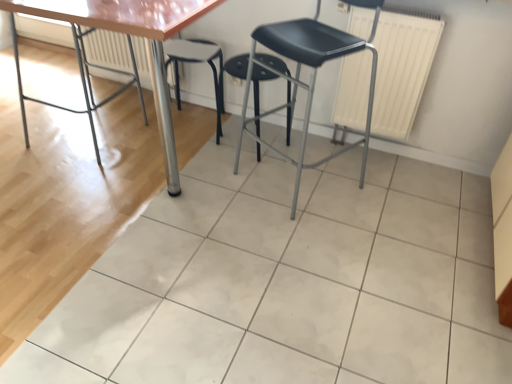
What is the approximate height of white matte radiator at upper right, placed as the 2th radiator when sorted from left to right?

The height of white matte radiator at upper right, placed as the 2th radiator when sorted from left to right, is 24.46 inches.

In order to face black plastic stool at center, acting as the second stool starting from the left, should I rotate leftwards or rightwards?

Turn right by 0.582 degrees to look at black plastic stool at center, acting as the second stool starting from the left.

Image resolution: width=512 pixels, height=384 pixels. What do you see at coordinates (197, 62) in the screenshot?
I see `black plastic stool at center, arranged as the 1th stool when viewed from the left` at bounding box center [197, 62].

Describe the element at coordinates (311, 74) in the screenshot. I see `matte black stool at center` at that location.

Locate an element on the screen. white matte radiator at upper right, which appears as the 1th radiator when viewed from the right is located at coordinates (402, 68).

Would you say white matte radiator at upper right, the second radiator positioned from the back, is outside white textured radiator at upper center, which is counted as the 2th radiator, starting from the front?

Yes.

Looking at the image, does white matte radiator at upper right, which appears as the 1th radiator when viewed from the right, seem bigger or smaller compared to white textured radiator at upper center, which is counted as the first radiator, starting from the left?

In the image, white matte radiator at upper right, which appears as the 1th radiator when viewed from the right, appears to be smaller than white textured radiator at upper center, which is counted as the first radiator, starting from the left.

You are a GUI agent. You are given a task and a screenshot of the screen. Output one action in this format:
    pyautogui.click(x=<x>, y=<y>)
    Task: Click on the radiator above the white matte radiator at upper right, the second radiator positioned from the back (from the image's perspective)
    The width and height of the screenshot is (512, 384).
    Given the screenshot: What is the action you would take?
    pyautogui.click(x=108, y=50)

How much distance is there between white matte radiator at upper right, placed as the 2th radiator when sorted from left to right, and white textured radiator at upper center, which is counted as the 2th radiator, starting from the front?

white matte radiator at upper right, placed as the 2th radiator when sorted from left to right, is 1.26 meters from white textured radiator at upper center, which is counted as the 2th radiator, starting from the front.

From the image's perspective, which radiator is the 2nd one above the white glossy tile at center? Please provide its 2D coordinates.

[(108, 50)]

In terms of height, does white textured radiator at upper center, the second radiator from the right, look taller or shorter compared to white glossy tile at center?

Considering their sizes, white textured radiator at upper center, the second radiator from the right, has more height than white glossy tile at center.

Is white textured radiator at upper center, the second radiator from the right, further to the viewer compared to white glossy tile at center?

Yes, white textured radiator at upper center, the second radiator from the right, is further from the camera.

Is white textured radiator at upper center, the second radiator from the right, next to white glossy tile at center and touching it?

white textured radiator at upper center, the second radiator from the right, is not next to white glossy tile at center, and they're not touching.

Which object is closer to the camera, black plastic stool at center, the 1th stool viewed from the right, or metallic polished table at left?

metallic polished table at left is in front.

The image size is (512, 384). Identify the location of table located above the black plastic stool at center, the 1th stool viewed from the right (from a real-world perspective). (132, 34).

How distant is black plastic stool at center, the 1th stool viewed from the right, from metallic polished table at left?

black plastic stool at center, the 1th stool viewed from the right, is 74.05 centimeters from metallic polished table at left.

Based on the photo, would you say matte black stool at center is to the left or to the right of white matte radiator at upper right, the second radiator positioned from the back, in the picture?

matte black stool at center is positioned on white matte radiator at upper right, the second radiator positioned from the back,'s left side.

Is matte black stool at center positioned with its back to white matte radiator at upper right, which appears as the first radiator when viewed from the front?

Yes, matte black stool at center is positioned with its back facing white matte radiator at upper right, which appears as the first radiator when viewed from the front.

From a real-world perspective, is matte black stool at center beneath white matte radiator at upper right, placed as the 2th radiator when sorted from left to right?

No, from a real-world perspective, matte black stool at center is not under white matte radiator at upper right, placed as the 2th radiator when sorted from left to right.

Can you confirm if matte black stool at center is smaller than white matte radiator at upper right, the second radiator positioned from the back?

No.

Is metallic polished table at left positioned far away from black plastic stool at center, the second stool from the right?

metallic polished table at left is near black plastic stool at center, the second stool from the right, not far away.

Which is more to the right, metallic polished table at left or black plastic stool at center, the second stool from the right?

black plastic stool at center, the second stool from the right, is more to the right.

Is metallic polished table at left facing towards black plastic stool at center, arranged as the 1th stool when viewed from the left?

Yes, metallic polished table at left faces towards black plastic stool at center, arranged as the 1th stool when viewed from the left.

Considering the sizes of objects metallic polished table at left and black plastic stool at center, the second stool from the right, in the image provided, who is shorter, metallic polished table at left or black plastic stool at center, the second stool from the right,?

With less height is black plastic stool at center, the second stool from the right.

From the image's perspective, is white matte radiator at upper right, the second radiator positioned from the back, located above or below matte black stool at center?

white matte radiator at upper right, the second radiator positioned from the back, is above matte black stool at center.

Measure the distance between white matte radiator at upper right, which appears as the first radiator when viewed from the front, and matte black stool at center.

7.20 inches.

Is white matte radiator at upper right, placed as the 2th radiator when sorted from left to right, looking in the opposite direction of matte black stool at center?

white matte radiator at upper right, placed as the 2th radiator when sorted from left to right, does not have its back to matte black stool at center.

Is point (106, 30) closer or farther from the camera than point (288, 137)?

Point (106, 30) is positioned closer to the camera compared to point (288, 137).

The image size is (512, 384). In order to click on the 1st stool positioned below the white textured radiator at upper center, the second radiator from the right (from a real-world perspective) in this screenshot , I will do `click(258, 90)`.

From the image's perspective, between white textured radiator at upper center, which is counted as the first radiator, starting from the back, and black plastic stool at center, acting as the second stool starting from the left, who is located below?

black plastic stool at center, acting as the second stool starting from the left, is shown below in the image.

Is white textured radiator at upper center, which is counted as the 2th radiator, starting from the front, facing away from black plastic stool at center, acting as the second stool starting from the left?

→ No, black plastic stool at center, acting as the second stool starting from the left, is not at the back of white textured radiator at upper center, which is counted as the 2th radiator, starting from the front.

Where is `radiator below the white textured radiator at upper center, which is counted as the 2th radiator, starting from the front (from the image's perspective)`? radiator below the white textured radiator at upper center, which is counted as the 2th radiator, starting from the front (from the image's perspective) is located at coordinates (402, 68).

This screenshot has height=384, width=512. Find the location of `ceramic tile that is on the right side of white textured radiator at upper center, which is counted as the first radiator, starting from the left`. ceramic tile that is on the right side of white textured radiator at upper center, which is counted as the first radiator, starting from the left is located at coordinates (287, 281).

From the image, which object appears to be farther from white matte radiator at upper right, the second radiator positioned from the back, black plastic stool at center, the 1th stool viewed from the right, or matte black stool at center?

black plastic stool at center, the 1th stool viewed from the right.

Considering their positions, is white matte radiator at upper right, which appears as the 1th radiator when viewed from the right, positioned further to white glossy tile at center than black plastic stool at center, the second stool from the right?

The object further to white glossy tile at center is black plastic stool at center, the second stool from the right.

Considering their positions, is white glossy tile at center positioned further to black plastic stool at center, arranged as the 1th stool when viewed from the left, than white textured radiator at upper center, the second radiator from the right?

The object further to black plastic stool at center, arranged as the 1th stool when viewed from the left, is white glossy tile at center.

Looking at the image, which one is located further to white glossy tile at center, metallic polished table at left or matte black stool at center?

metallic polished table at left lies further to white glossy tile at center than the other object.

From the image, which object appears to be farther from black plastic stool at center, the 1th stool viewed from the right, white matte radiator at upper right, which appears as the 1th radiator when viewed from the right, or black plastic stool at center, arranged as the 1th stool when viewed from the left?

white matte radiator at upper right, which appears as the 1th radiator when viewed from the right, is positioned further to the anchor black plastic stool at center, the 1th stool viewed from the right.

Consider the image. When comparing their distances from matte black stool at center, does black plastic stool at center, the second stool from the right, or black plastic stool at center, the 1th stool viewed from the right, seem closer?

The object closer to matte black stool at center is black plastic stool at center, the 1th stool viewed from the right.

From the image, which object appears to be farther from white matte radiator at upper right, which appears as the first radiator when viewed from the front, matte black stool at center or white textured radiator at upper center, which is counted as the first radiator, starting from the left?

Based on the image, white textured radiator at upper center, which is counted as the first radiator, starting from the left, appears to be further to white matte radiator at upper right, which appears as the first radiator when viewed from the front.

From the image, which object appears to be farther from metallic polished table at left, white textured radiator at upper center, which is counted as the first radiator, starting from the left, or matte black stool at center?

matte black stool at center lies further to metallic polished table at left than the other object.

Where is `table located between white glossy tile at center and black plastic stool at center, the 1th stool viewed from the right, in the depth direction`? table located between white glossy tile at center and black plastic stool at center, the 1th stool viewed from the right, in the depth direction is located at coordinates (132, 34).

Where is `table between white glossy tile at center and black plastic stool at center, the second stool from the right, in the front-back direction`? This screenshot has height=384, width=512. table between white glossy tile at center and black plastic stool at center, the second stool from the right, in the front-back direction is located at coordinates (132, 34).

At what (x,y) coordinates should I click in order to perform the action: click on stool located between matte black stool at center and black plastic stool at center, arranged as the 1th stool when viewed from the left, in the depth direction. Please return your answer as a coordinate pair (x, y). Looking at the image, I should click on (258, 90).

This screenshot has height=384, width=512. What are the coordinates of `radiator situated between metallic polished table at left and black plastic stool at center, acting as the second stool starting from the left, from left to right` in the screenshot? It's located at (108, 50).